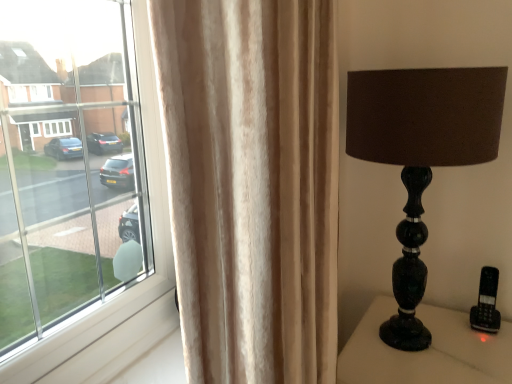
Where is `vacant space underneath shiny black glass lamp at right (from a real-world perspective)`? vacant space underneath shiny black glass lamp at right (from a real-world perspective) is located at coordinates (408, 340).